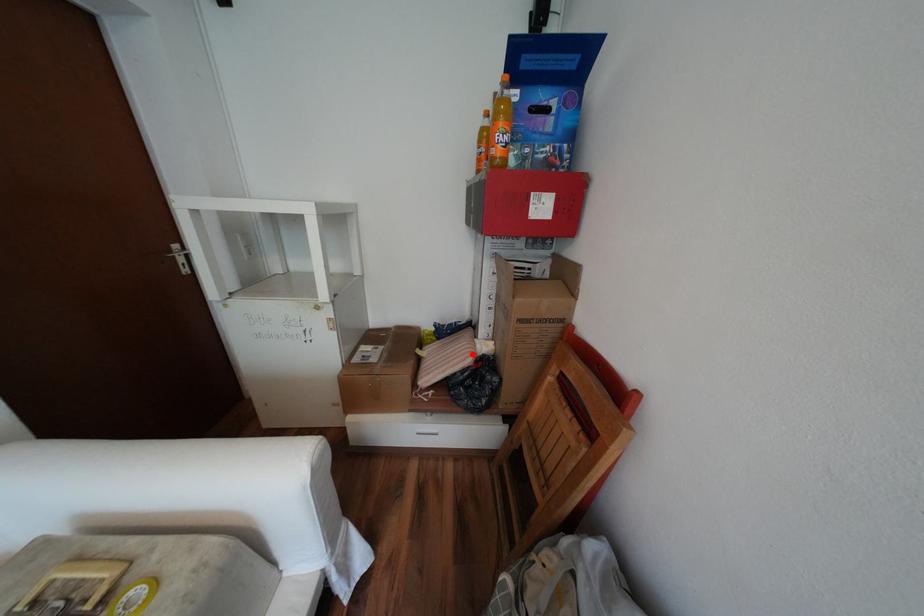
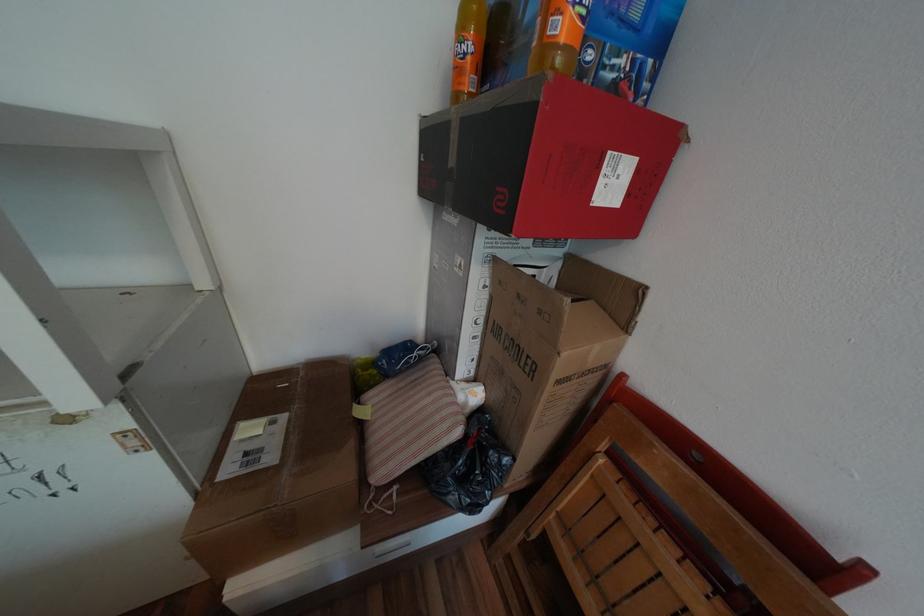
Where in the second image is the point corresponding to the highlighted location from the first image?

(453, 419)